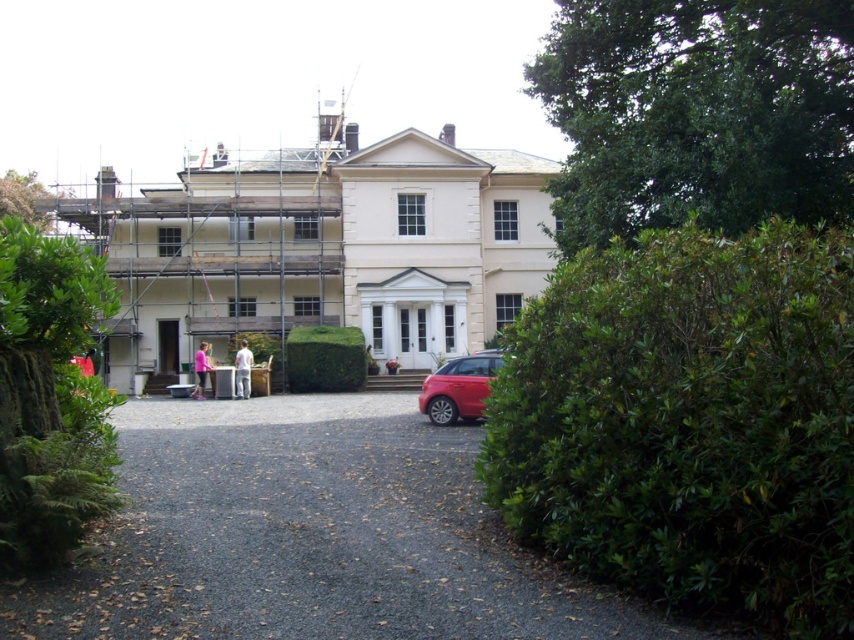
Can you confirm if gray gravel driveway at center is positioned above pink fabric person at center?

Yes, gray gravel driveway at center is above pink fabric person at center.

Is point (474, 531) more distant than point (197, 369)?

No.

Identify the location of gray gravel driveway at center. The height and width of the screenshot is (640, 854). (308, 536).

Based on the photo, which is above, white cotton shirt at center or pink fabric person at center?

Positioned higher is white cotton shirt at center.

Is white cotton shirt at center to the right of pink fabric person at center from the viewer's perspective?

Indeed, white cotton shirt at center is positioned on the right side of pink fabric person at center.

This screenshot has width=854, height=640. What do you see at coordinates (243, 369) in the screenshot? I see `white cotton shirt at center` at bounding box center [243, 369].

Where is `white cotton shirt at center`? This screenshot has height=640, width=854. white cotton shirt at center is located at coordinates click(x=243, y=369).

Who is positioned more to the right, green leafy hedge at right or green leafy hedge at center?

Positioned to the right is green leafy hedge at right.

Is green leafy hedge at right thinner than green leafy hedge at center?

Yes.

Is point (781, 522) farther from camera compared to point (299, 348)?

No, it is in front of (299, 348).

Find the location of a particular element. Image resolution: width=854 pixels, height=640 pixels. green leafy hedge at right is located at coordinates (689, 422).